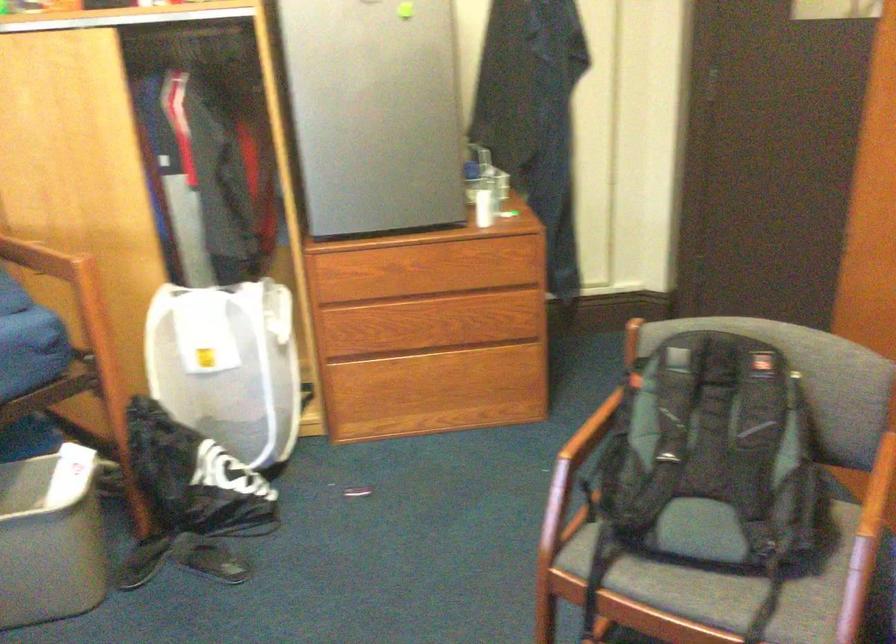
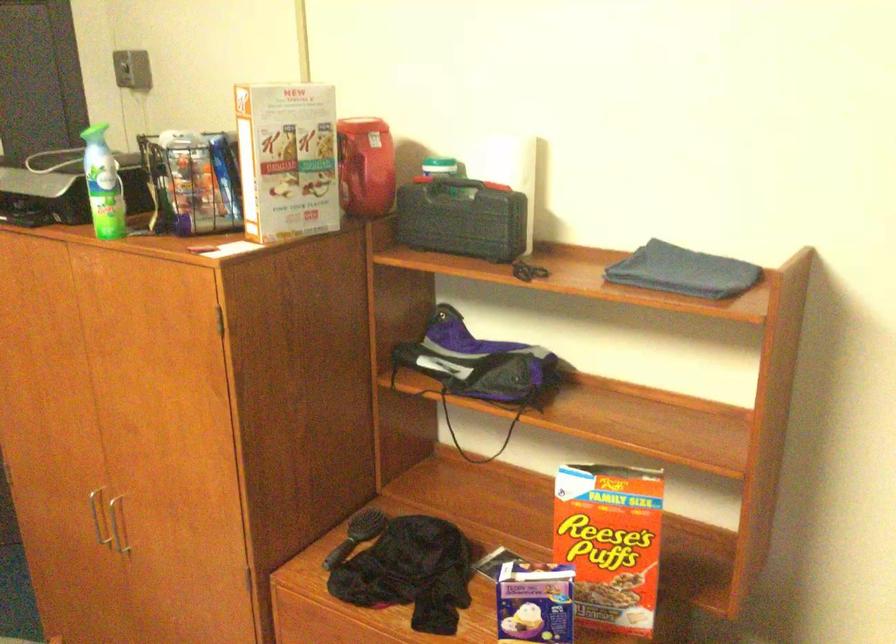
Question: Based on the continuous images, in which direction is the camera rotating? Reply with the corresponding letter.

Choices:
 (A) Left
 (B) Right
 (C) Up
 (D) Down

Answer: (B)